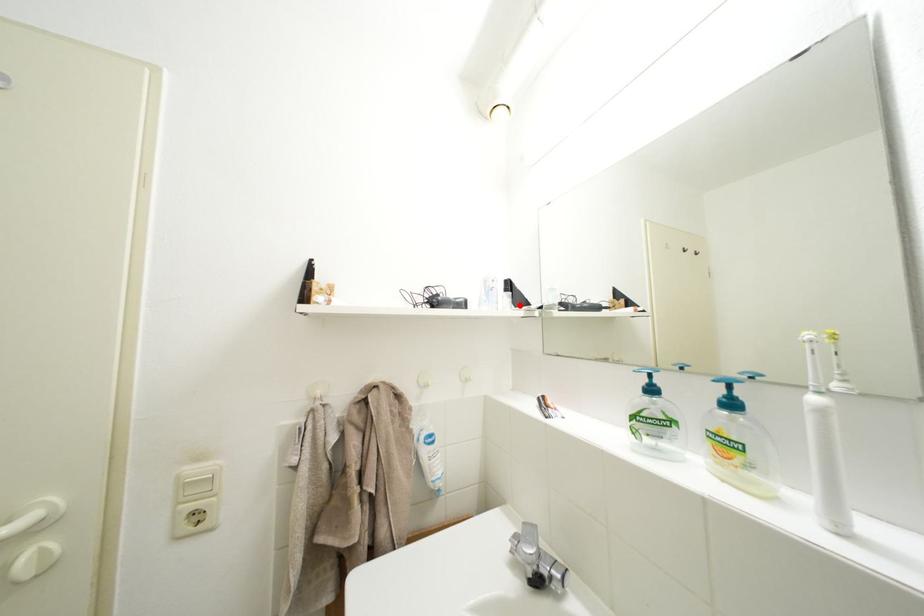
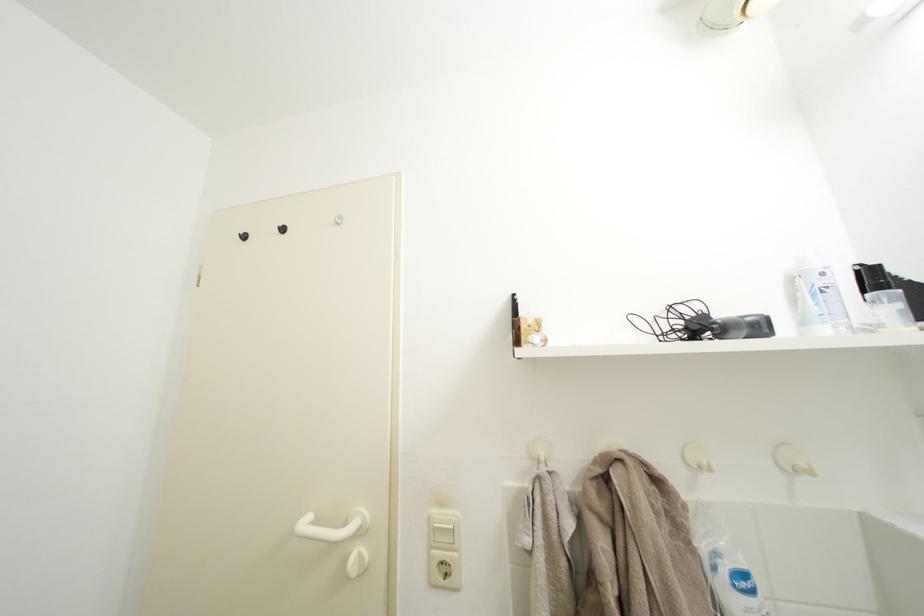
The point at the highlighted location is marked in the first image. Where is the corresponding point in the second image?

(910, 310)